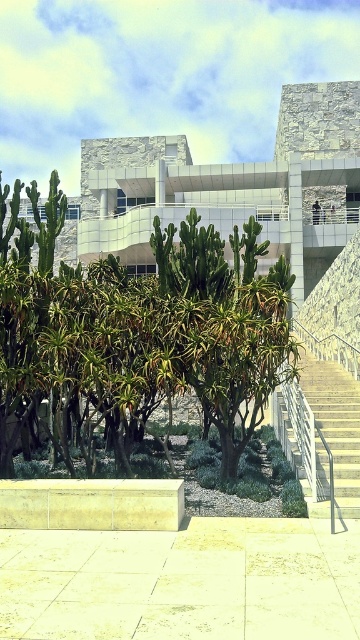
Question: Can you confirm if green leafy tree at center is positioned to the left of white concrete stairs at right?

Choices:
 (A) no
 (B) yes

Answer: (B)

Question: Which point is farther to the camera?

Choices:
 (A) (213, 337)
 (B) (342, 488)

Answer: (B)

Question: Is green leafy tree at center wider than white concrete stairs at right?

Choices:
 (A) no
 (B) yes

Answer: (A)

Question: Is the position of green leafy tree at center less distant than that of white concrete stairs at right?

Choices:
 (A) no
 (B) yes

Answer: (A)